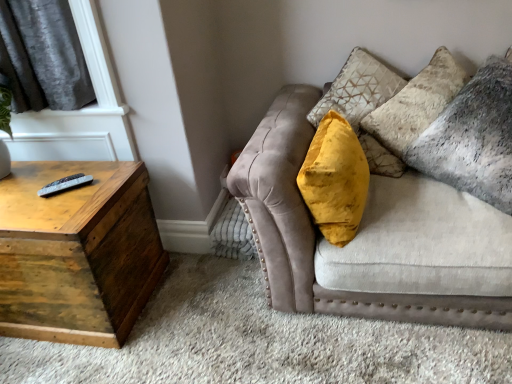
I want to click on vacant region to the left of black plastic remote at left, so click(30, 191).